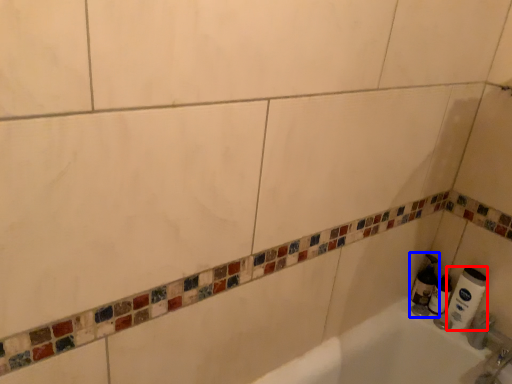
Question: Among these objects, which one is farthest to the camera, toilet paper (highlighted by a red box) or soap dispenser (highlighted by a blue box)?

Choices:
 (A) toilet paper
 (B) soap dispenser

Answer: (B)